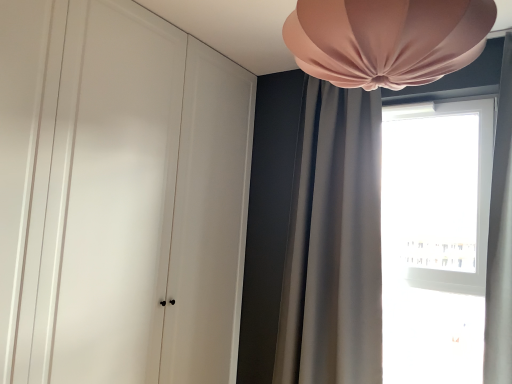
Question: From a real-world perspective, is pink fabric lampshade at upper center on satin gray curtain at upper right?

Choices:
 (A) yes
 (B) no

Answer: (A)

Question: Does pink fabric lampshade at upper center have a lesser height compared to satin gray curtain at upper right?

Choices:
 (A) yes
 (B) no

Answer: (A)

Question: Can you confirm if pink fabric lampshade at upper center is positioned to the right of satin gray curtain at upper right?

Choices:
 (A) yes
 (B) no

Answer: (B)

Question: Does pink fabric lampshade at upper center have a greater height compared to satin gray curtain at upper right?

Choices:
 (A) no
 (B) yes

Answer: (A)

Question: Is pink fabric lampshade at upper center smaller than satin gray curtain at upper right?

Choices:
 (A) no
 (B) yes

Answer: (B)

Question: Is pink fabric lampshade at upper center outside satin gray curtain at upper right?

Choices:
 (A) no
 (B) yes

Answer: (B)

Question: Considering the relative sizes of satin gray curtain at upper right and pink fabric lampshade at upper center in the image provided, is satin gray curtain at upper right taller than pink fabric lampshade at upper center?

Choices:
 (A) no
 (B) yes

Answer: (B)

Question: Is satin gray curtain at upper right next to pink fabric lampshade at upper center?

Choices:
 (A) yes
 (B) no

Answer: (B)

Question: Is satin gray curtain at upper right outside pink fabric lampshade at upper center?

Choices:
 (A) yes
 (B) no

Answer: (A)

Question: Can you confirm if satin gray curtain at upper right is wider than pink fabric lampshade at upper center?

Choices:
 (A) yes
 (B) no

Answer: (B)

Question: Is satin gray curtain at upper right shorter than pink fabric lampshade at upper center?

Choices:
 (A) no
 (B) yes

Answer: (A)

Question: Does satin gray curtain at upper right appear on the right side of pink fabric lampshade at upper center?

Choices:
 (A) yes
 (B) no

Answer: (A)

Question: Does satin gray curtain at upper right appear on the right side of transparent glass window at right?

Choices:
 (A) no
 (B) yes

Answer: (A)